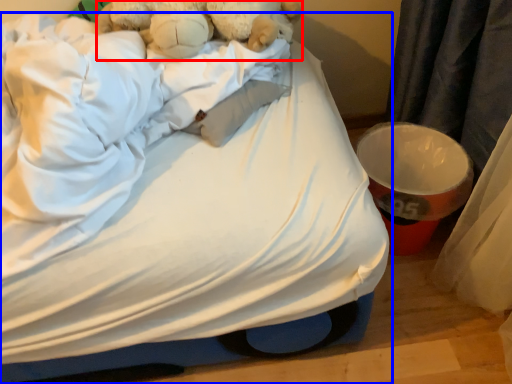
Question: Which object appears farthest to the camera in this image, teddy bear (highlighted by a red box) or bed (highlighted by a blue box)?

Choices:
 (A) teddy bear
 (B) bed

Answer: (A)